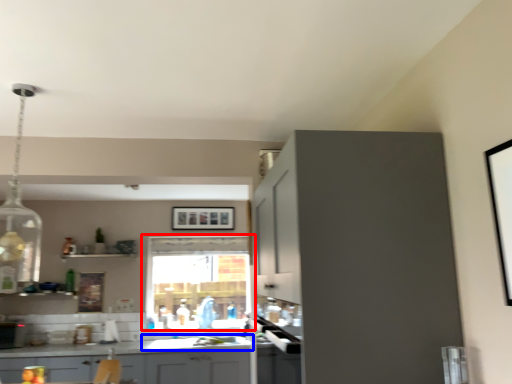
Question: Which object is further to the camera taking this photo, window (highlighted by a red box) or sink (highlighted by a blue box)?

Choices:
 (A) window
 (B) sink

Answer: (A)